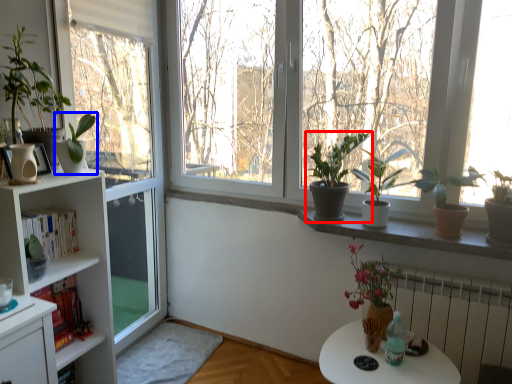
Question: Which object is further to the camera taking this photo, houseplant (highlighted by a red box) or houseplant (highlighted by a blue box)?

Choices:
 (A) houseplant
 (B) houseplant

Answer: (A)